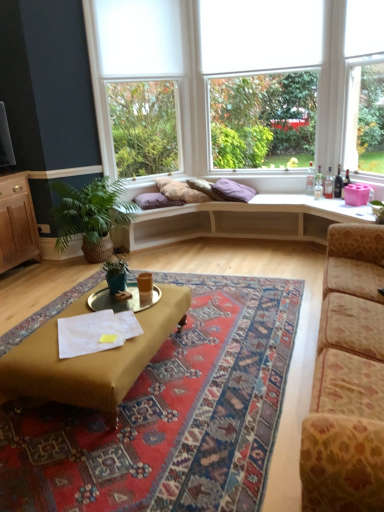
I want to click on vacant space in front of green matte plant at center, which is the 2th houseplant in back-to-front order, so click(109, 303).